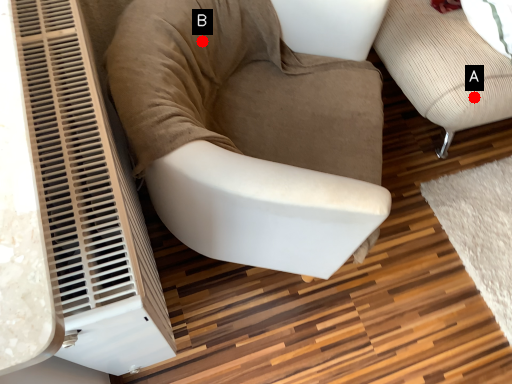
Question: Two points are circled on the image, labeled by A and B beside each circle. Which point appears closest to the camera in this image?

Choices:
 (A) A is closer
 (B) B is closer

Answer: (B)